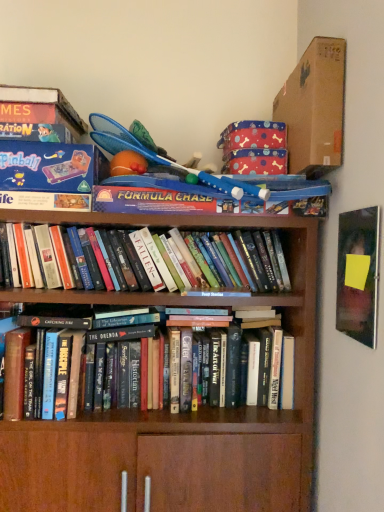
What is the approximate height of matte black book at upper right?

matte black book at upper right is 12.38 inches in height.

In order to face matte black book at upper right, should I rotate leftwards or rightwards?

A 21.253 degree turn to the right will do.

You are a GUI agent. You are given a task and a screenshot of the screen. Output one action in this format:
    pyautogui.click(x=<x>, y=<y>)
    Task: Click on the blue plastic toy at upper center
    The width and height of the screenshot is (384, 512).
    Given the screenshot: What is the action you would take?
    pyautogui.click(x=164, y=158)

The image size is (384, 512). What do you see at coordinates (164, 158) in the screenshot?
I see `blue plastic toy at upper center` at bounding box center [164, 158].

What are the coordinates of `hardcover books at center, placed as the 2th book when sorted from bottom to top` in the screenshot? It's located at (238, 261).

This screenshot has height=512, width=384. I want to click on hardcover books at center, which is the 2th book in top-to-bottom order, so click(x=57, y=358).

Where is `matte black book at upper right`? matte black book at upper right is located at coordinates (358, 274).

Based on the photo, from a real-world perspective, is brown cardboard box at upper right under hardcover books at center, which is the 2th book in top-to-bottom order?

No, from a real-world perspective, brown cardboard box at upper right is not below hardcover books at center, which is the 2th book in top-to-bottom order.

This screenshot has height=512, width=384. In order to click on book that is the 2nd object located below the brown cardboard box at upper right (from the image's perspective) in this screenshot , I will do `click(57, 358)`.

Can you confirm if brown cardboard box at upper right is bigger than hardcover books at center, which is the 2th book in top-to-bottom order?

No.

Is brown cardboard box at upper right looking in the opposite direction of hardcover books at center, which is the 2th book in top-to-bottom order?

That's not correct — brown cardboard box at upper right is not looking away from hardcover books at center, which is the 2th book in top-to-bottom order.

Is matte black book at upper right to the left of brown cardboard box at upper right from the viewer's perspective?

No.

Measure the distance between matte black book at upper right and brown cardboard box at upper right.

matte black book at upper right and brown cardboard box at upper right are 12.71 inches apart from each other.

Can you tell me how much matte black book at upper right and brown cardboard box at upper right differ in facing direction?

88.7 degrees separate the facing orientations of matte black book at upper right and brown cardboard box at upper right.

Are matte black book at upper right and brown cardboard box at upper right making contact?

matte black book at upper right and brown cardboard box at upper right are clearly separated.

From the image's perspective, is hardcover books at center, placed as the 2th book when sorted from bottom to top, located above or below blue plastic toy at upper center?

hardcover books at center, placed as the 2th book when sorted from bottom to top, is situated lower than blue plastic toy at upper center in the image.

Consider the image. Considering the relative sizes of hardcover books at center, which ranks as the 1th book in top-to-bottom order, and blue plastic toy at upper center in the image provided, is hardcover books at center, which ranks as the 1th book in top-to-bottom order, wider than blue plastic toy at upper center?

In fact, hardcover books at center, which ranks as the 1th book in top-to-bottom order, might be narrower than blue plastic toy at upper center.

Does hardcover books at center, placed as the 2th book when sorted from bottom to top, have a larger size compared to blue plastic toy at upper center?

No, hardcover books at center, placed as the 2th book when sorted from bottom to top, is not bigger than blue plastic toy at upper center.

Consider the image. Can you confirm if hardcover books at center, placed as the 2th book when sorted from bottom to top, is taller than blue plastic toy at upper center?

In fact, hardcover books at center, placed as the 2th book when sorted from bottom to top, may be shorter than blue plastic toy at upper center.

Which object is wider, matte black book at upper right or hardcover books at center, which is the 2th book in top-to-bottom order?

hardcover books at center, which is the 2th book in top-to-bottom order.

Is matte black book at upper right positioned behind hardcover books at center, which is the 2th book in top-to-bottom order?

No, it is in front of hardcover books at center, which is the 2th book in top-to-bottom order.

Consider the image. What's the angular difference between matte black book at upper right and hardcover books at center, the 1th book ordered from the bottom,'s facing directions?

The angle between the facing direction of matte black book at upper right and the facing direction of hardcover books at center, the 1th book ordered from the bottom, is 89.9 degrees.

Which is nearer, (367, 311) or (16, 406)?

Point (367, 311) is closer to the camera than point (16, 406).

From the picture: Considering their positions, is blue plastic toy at upper center located in front of or behind hardcover books at center, which is the 2th book in top-to-bottom order?

blue plastic toy at upper center is positioned closer to the viewer than hardcover books at center, which is the 2th book in top-to-bottom order.

Who is bigger, blue plastic toy at upper center or hardcover books at center, which is the 2th book in top-to-bottom order?

Bigger between the two is hardcover books at center, which is the 2th book in top-to-bottom order.

Which point is more distant from viewer, (135, 141) or (72, 398)?

The point (135, 141) is more distant.

From a real-world perspective, which is physically below, blue plastic toy at upper center or hardcover books at center, which is the 2th book in top-to-bottom order?

hardcover books at center, which is the 2th book in top-to-bottom order, from a real-world perspective.

Is hardcover books at center, which ranks as the 1th book in top-to-bottom order, at the back of brown cardboard box at upper right?

brown cardboard box at upper right does not have its back to hardcover books at center, which ranks as the 1th book in top-to-bottom order.

Locate an element on the screen. cardboard box in front of the hardcover books at center, which ranks as the 1th book in top-to-bottom order is located at coordinates (314, 108).

Does brown cardboard box at upper right have a larger size compared to hardcover books at center, which ranks as the 1th book in top-to-bottom order?

Incorrect, brown cardboard box at upper right is not larger than hardcover books at center, which ranks as the 1th book in top-to-bottom order.

Considering their positions, is brown cardboard box at upper right located in front of or behind hardcover books at center, which ranks as the 1th book in top-to-bottom order?

Visually, brown cardboard box at upper right is located in front of hardcover books at center, which ranks as the 1th book in top-to-bottom order.

Which is correct: brown cardboard box at upper right is inside blue plastic toy at upper center, or outside of it?

brown cardboard box at upper right is outside blue plastic toy at upper center.

Is brown cardboard box at upper right facing towards blue plastic toy at upper center?

No, brown cardboard box at upper right is not aimed at blue plastic toy at upper center.

Identify the location of cardboard box above the hardcover books at center, the 1th book ordered from the bottom (from a real-world perspective). (314, 108).

Locate an element on the screen. The width and height of the screenshot is (384, 512). paperback book that appears below the brown cardboard box at upper right (from the image's perspective) is located at coordinates (358, 274).

In the scene shown: Considering their positions, is matte black book at upper right positioned closer to hardcover books at center, which ranks as the 1th book in top-to-bottom order, than brown cardboard box at upper right?

matte black book at upper right is closer to hardcover books at center, which ranks as the 1th book in top-to-bottom order.

Looking at the image, which one is located closer to matte black book at upper right, blue plastic toy at upper center or hardcover books at center, placed as the 2th book when sorted from bottom to top?

blue plastic toy at upper center is closer to matte black book at upper right.

Which object lies nearer to the anchor point hardcover books at center, placed as the 2th book when sorted from bottom to top, brown cardboard box at upper right or matte black book at upper right?

Among the two, matte black book at upper right is located nearer to hardcover books at center, placed as the 2th book when sorted from bottom to top.

Looking at the image, which one is located closer to matte black book at upper right, hardcover books at center, placed as the 2th book when sorted from bottom to top, or hardcover books at center, which is the 2th book in top-to-bottom order?

The object closer to matte black book at upper right is hardcover books at center, placed as the 2th book when sorted from bottom to top.

Estimate the real-world distances between objects in this image. Which object is closer to matte black book at upper right, blue plastic toy at upper center or hardcover books at center, the 1th book ordered from the bottom?

blue plastic toy at upper center lies closer to matte black book at upper right than the other object.

When comparing their distances from matte black book at upper right, does hardcover books at center, the 1th book ordered from the bottom, or hardcover books at center, which ranks as the 1th book in top-to-bottom order, seem closer?

Among the two, hardcover books at center, which ranks as the 1th book in top-to-bottom order, is located nearer to matte black book at upper right.

When comparing their distances from hardcover books at center, which ranks as the 1th book in top-to-bottom order, does blue plastic toy at upper center or hardcover books at center, the 1th book ordered from the bottom, seem closer?

hardcover books at center, the 1th book ordered from the bottom, lies closer to hardcover books at center, which ranks as the 1th book in top-to-bottom order, than the other object.

Based on their spatial positions, is brown cardboard box at upper right or blue plastic toy at upper center closer to matte black book at upper right?

brown cardboard box at upper right is closer to matte black book at upper right.

Where is `toy located between hardcover books at center, placed as the 2th book when sorted from bottom to top, and brown cardboard box at upper right in the left-right direction`? This screenshot has width=384, height=512. toy located between hardcover books at center, placed as the 2th book when sorted from bottom to top, and brown cardboard box at upper right in the left-right direction is located at coordinates (164, 158).

You are a GUI agent. You are given a task and a screenshot of the screen. Output one action in this format:
    pyautogui.click(x=<x>, y=<y>)
    Task: Click on the paperback book between brown cardboard box at upper right and hardcover books at center, the 1th book ordered from the bottom, from top to bottom
    
    Given the screenshot: What is the action you would take?
    pyautogui.click(x=358, y=274)

What are the coordinates of `toy between brown cardboard box at upper right and hardcover books at center, which is the 2th book in top-to-bottom order, in the up-down direction` in the screenshot? It's located at (164, 158).

Identify the location of cardboard box located between hardcover books at center, which ranks as the 1th book in top-to-bottom order, and matte black book at upper right in the left-right direction. The height and width of the screenshot is (512, 384). (314, 108).